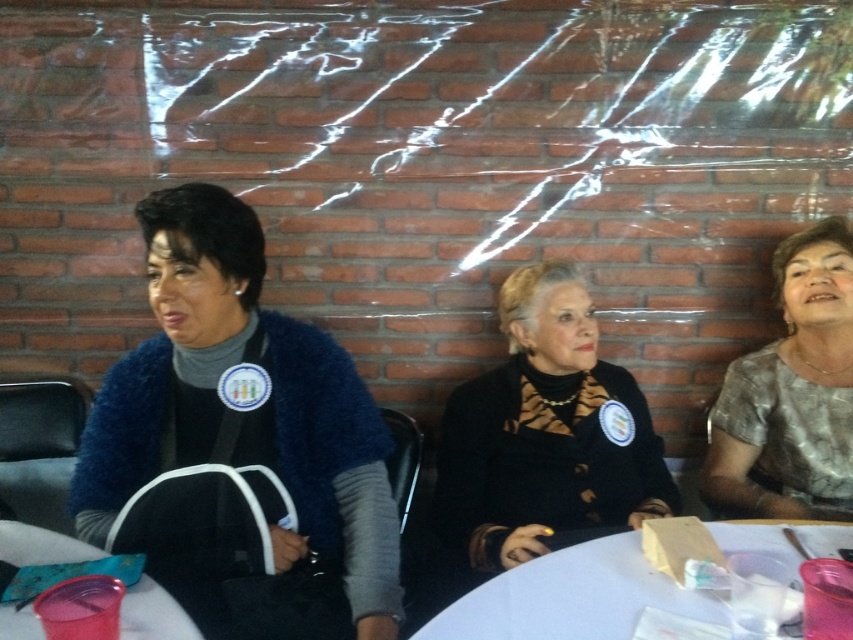
In the scene shown: Does black textured jacket at center have a lesser width compared to white plastic table at center?

Yes.

Does point (538, 369) come in front of point (630, 586)?

No, it is not.

Where is `black textured jacket at center`? black textured jacket at center is located at coordinates (544, 433).

Where is `black textured jacket at center`? The width and height of the screenshot is (853, 640). black textured jacket at center is located at coordinates (544, 433).

Who is more distant from viewer, (160, 458) or (511, 365)?

The point (511, 365) is more distant.

Which is below, blue fuzzy sweater at left or black textured jacket at center?

black textured jacket at center is below.

Who is more distant from viewer, (370, 456) or (525, 538)?

Positioned behind is point (370, 456).

The image size is (853, 640). What are the coordinates of `blue fuzzy sweater at left` in the screenshot? It's located at (242, 410).

Does black textured jacket at center appear under translucent plastic cup at lower left?

Incorrect, black textured jacket at center is not positioned below translucent plastic cup at lower left.

Does black textured jacket at center have a greater height compared to translucent plastic cup at lower left?

Indeed, black textured jacket at center has a greater height compared to translucent plastic cup at lower left.

Where is `black textured jacket at center`? The image size is (853, 640). black textured jacket at center is located at coordinates (544, 433).

The image size is (853, 640). What are the coordinates of `black textured jacket at center` in the screenshot? It's located at (544, 433).